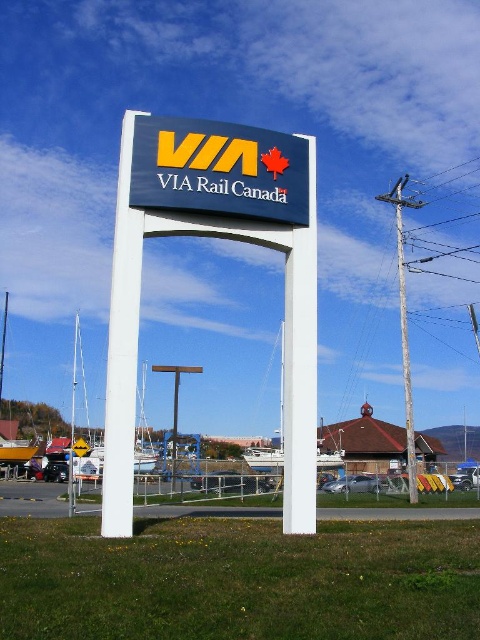
Measure the distance between white plastic sign at center and camera.

white plastic sign at center and camera are 36.72 feet apart.

From the picture: Who is higher up, white plastic sign at center or blue matte sign at center?

blue matte sign at center

Between point (273, 237) and point (224, 202), which one is positioned in front?

Positioned in front is point (224, 202).

You are a GUI agent. You are given a task and a screenshot of the screen. Output one action in this format:
    pyautogui.click(x=<x>, y=<y>)
    Task: Click on the white plastic sign at center
    The height and width of the screenshot is (640, 480).
    Given the screenshot: What is the action you would take?
    pyautogui.click(x=222, y=237)

Looking at this image, who is lower down, blue matte sign at center or weathered wood utility pole at right?

Positioned lower is weathered wood utility pole at right.

Between point (157, 156) and point (387, 196), which one is positioned behind?

The point (387, 196) is more distant.

Image resolution: width=480 pixels, height=640 pixels. I want to click on blue matte sign at center, so click(x=218, y=170).

In the scene shown: Is white plastic sign at center shorter than weathered wood utility pole at right?

Yes.

Which of these two, white plastic sign at center or weathered wood utility pole at right, stands taller?

weathered wood utility pole at right

Is point (308, 326) closer to camera compared to point (406, 392)?

Yes, point (308, 326) is in front of point (406, 392).

Where is `white plastic sign at center`? white plastic sign at center is located at coordinates (222, 237).